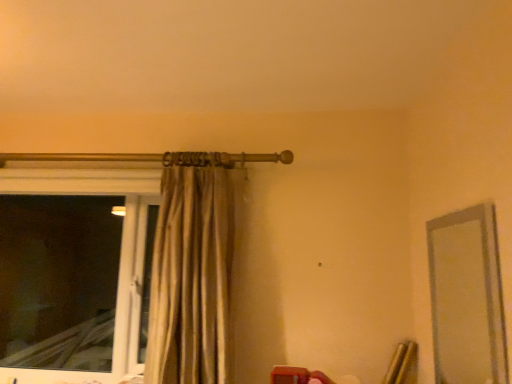
Question: From the image's perspective, would you say clear glass mirror at right is shown under transparent glass window at left?

Choices:
 (A) yes
 (B) no

Answer: (B)

Question: Is clear glass mirror at right positioned beyond the bounds of transparent glass window at left?

Choices:
 (A) no
 (B) yes

Answer: (B)

Question: Is clear glass mirror at right aimed at transparent glass window at left?

Choices:
 (A) no
 (B) yes

Answer: (B)

Question: From a real-world perspective, is clear glass mirror at right over transparent glass window at left?

Choices:
 (A) yes
 (B) no

Answer: (A)

Question: Is clear glass mirror at right bigger than transparent glass window at left?

Choices:
 (A) yes
 (B) no

Answer: (B)

Question: Considering the relative positions of clear glass mirror at right and beige fabric curtain at upper center in the image provided, is clear glass mirror at right to the left or to the right of beige fabric curtain at upper center?

Choices:
 (A) left
 (B) right

Answer: (B)

Question: Considering their positions, is clear glass mirror at right located in front of or behind beige fabric curtain at upper center?

Choices:
 (A) front
 (B) behind

Answer: (A)

Question: From the image's perspective, is clear glass mirror at right located above or below beige fabric curtain at upper center?

Choices:
 (A) above
 (B) below

Answer: (B)

Question: In terms of width, does clear glass mirror at right look wider or thinner when compared to beige fabric curtain at upper center?

Choices:
 (A) wide
 (B) thin

Answer: (B)

Question: In terms of width, does clear glass mirror at right look wider or thinner when compared to transparent glass window at left?

Choices:
 (A) thin
 (B) wide

Answer: (A)

Question: Considering the relative positions of clear glass mirror at right and transparent glass window at left in the image provided, is clear glass mirror at right to the left or to the right of transparent glass window at left?

Choices:
 (A) right
 (B) left

Answer: (A)

Question: Considering the positions of clear glass mirror at right and transparent glass window at left in the image, is clear glass mirror at right bigger or smaller than transparent glass window at left?

Choices:
 (A) big
 (B) small

Answer: (B)

Question: From the image's perspective, relative to transparent glass window at left, is clear glass mirror at right above or below?

Choices:
 (A) above
 (B) below

Answer: (A)

Question: In terms of height, does beige fabric curtain at upper center look taller or shorter compared to transparent glass window at left?

Choices:
 (A) short
 (B) tall

Answer: (B)

Question: Is beige fabric curtain at upper center to the left or to the right of transparent glass window at left in the image?

Choices:
 (A) right
 (B) left

Answer: (A)